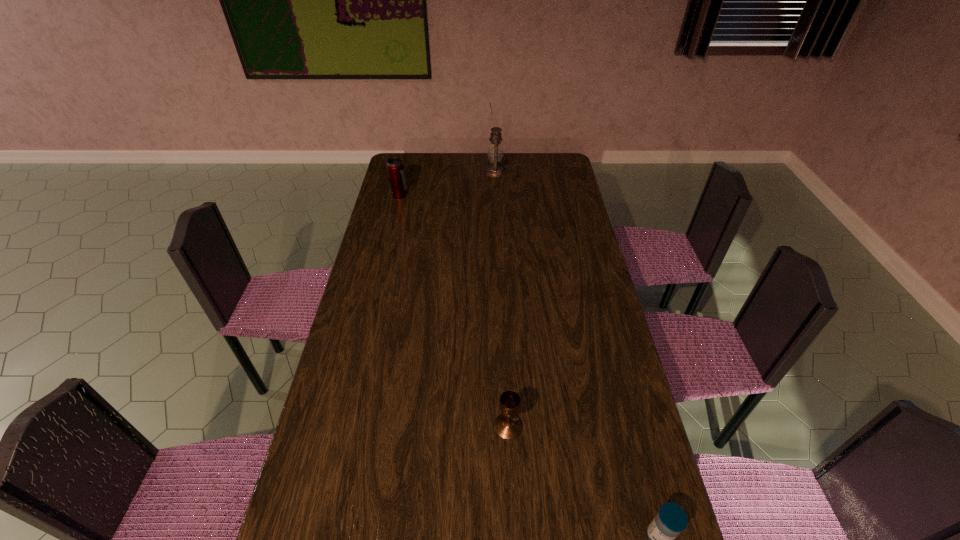
Find the location of `the farthest object`. the farthest object is located at coordinates (495, 153).

This screenshot has width=960, height=540. Find the location of `the tallest object`. the tallest object is located at coordinates (495, 153).

Find the location of `thermos bottle`. thermos bottle is located at coordinates (395, 167).

You are a GUI agent. You are given a task and a screenshot of the screen. Output one action in this format:
    pyautogui.click(x=<x>, y=<y>)
    Task: Click on the leftmost object
    This screenshot has width=960, height=540.
    Given the screenshot: What is the action you would take?
    pyautogui.click(x=395, y=167)

In order to click on the third tallest object in this screenshot , I will do `click(508, 426)`.

The height and width of the screenshot is (540, 960). I want to click on chalice, so click(508, 426).

At what (x,y) coordinates should I click in order to perform the action: click on vacant area located on the front of the tallest object. Please return your answer as a coordinate pair (x, y). Looking at the image, I should click on (496, 194).

Find the location of a particular element. This screenshot has width=960, height=540. free region located 0.290m on the side with the handle of the leftmost object is located at coordinates (475, 195).

At what (x,y) coordinates should I click in order to perform the action: click on vacant region located on the back of the third tallest object. Please return your answer as a coordinate pair (x, y). The image size is (960, 540). Looking at the image, I should click on (505, 367).

Locate an element on the screen. Image resolution: width=960 pixels, height=540 pixels. object that is at the far edge is located at coordinates (495, 153).